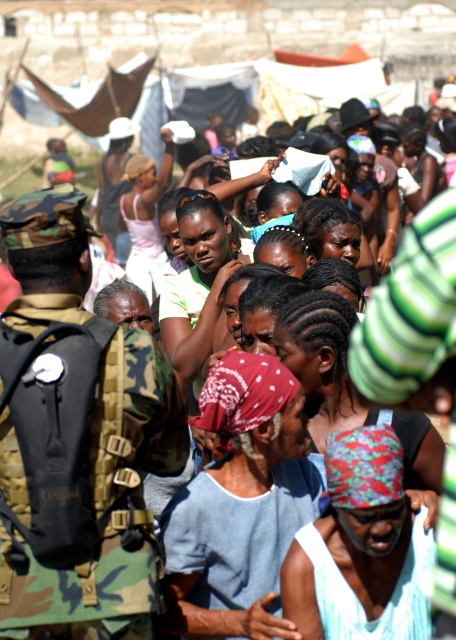
Question: Among these objects, which one is nearest to the camera?

Choices:
 (A) multicolored fabric headscarf at center
 (B) matte black sunglasses at center
 (C) light blue fabric at center
 (D) camo uniform at left

Answer: (A)

Question: Can you confirm if camo uniform at left is positioned below matte black sunglasses at center?

Choices:
 (A) no
 (B) yes

Answer: (B)

Question: From the image, what is the correct spatial relationship of light blue fabric at center in relation to matte black sunglasses at center?

Choices:
 (A) left
 (B) right

Answer: (B)

Question: Which point is closer to the camera?

Choices:
 (A) (41, 257)
 (B) (185, 211)

Answer: (A)

Question: Which of the following is the closest to the observer?

Choices:
 (A) matte black sunglasses at center
 (B) multicolored fabric headscarf at center

Answer: (B)

Question: Is the position of light blue fabric at center more distant than that of multicolored fabric headscarf at center?

Choices:
 (A) no
 (B) yes

Answer: (B)